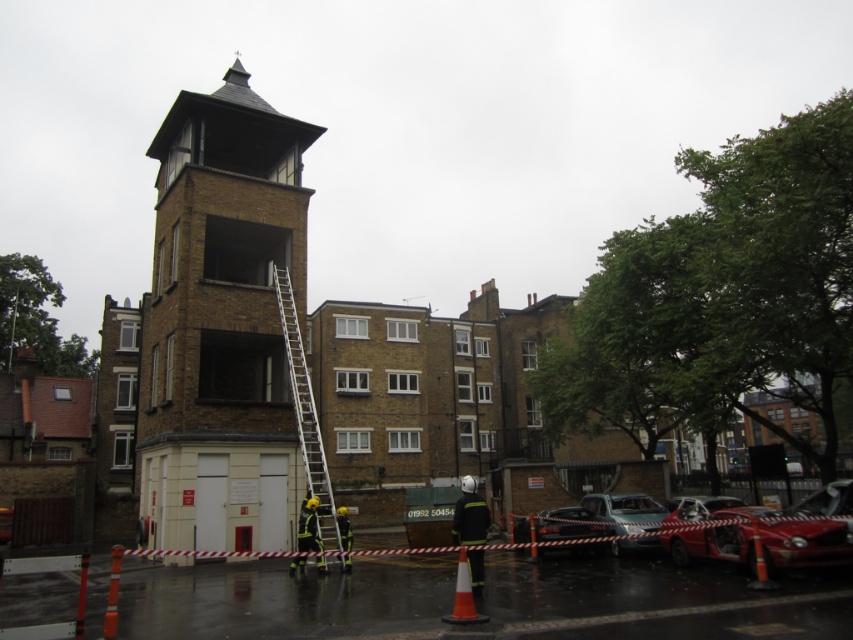
Question: Does damaged red car at lower right appear under metallic silver car at center?

Choices:
 (A) yes
 (B) no

Answer: (A)

Question: Estimate the real-world distances between objects in this image. Which object is closer to the metallic silver car at center?

Choices:
 (A) metallic silver ladder at center
 (B) damaged red car at lower right

Answer: (B)

Question: Can you confirm if metallic silver ladder at center is thinner than metallic silver car at center?

Choices:
 (A) no
 (B) yes

Answer: (A)

Question: In this image, where is brown brick bell tower at center located relative to metallic silver ladder at center?

Choices:
 (A) above
 (B) below

Answer: (A)

Question: Estimate the real-world distances between objects in this image. Which object is farther from the damaged red car at lower right?

Choices:
 (A) metallic silver car at center
 (B) metallic silver ladder at center
 (C) brown brick bell tower at center

Answer: (C)

Question: Which of the following is the farthest from the observer?

Choices:
 (A) (316, 458)
 (B) (677, 515)

Answer: (A)